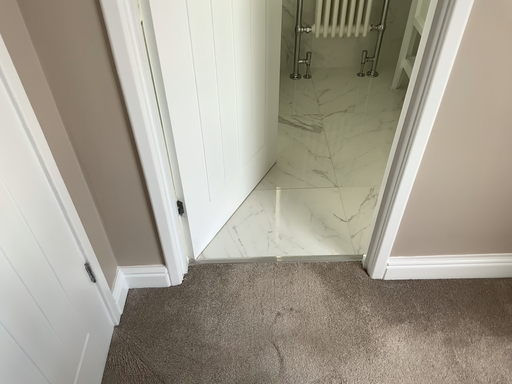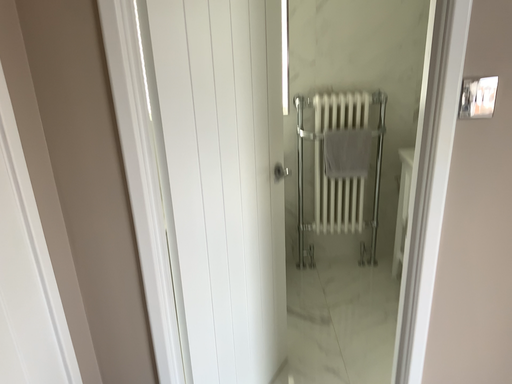
Question: How did the camera likely rotate when shooting the video?

Choices:
 (A) rotated downward
 (B) rotated upward

Answer: (B)